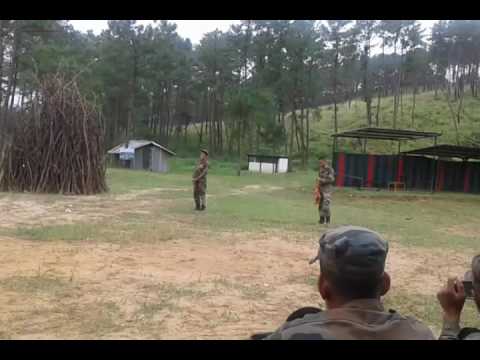
This screenshot has width=480, height=360. What are the coordinates of `wall` in the screenshot? It's located at (396, 186).